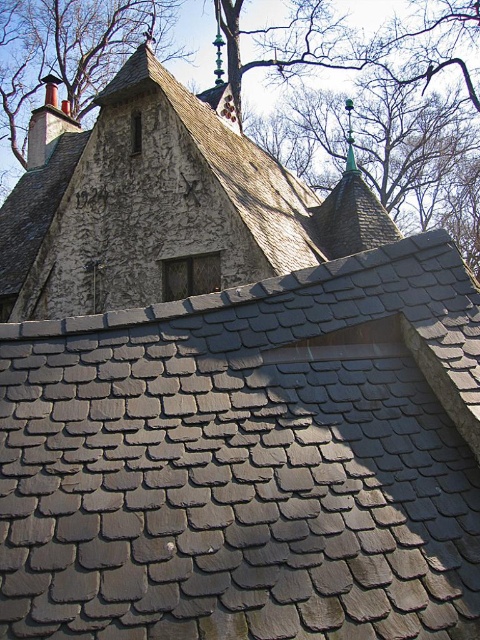
Question: Which of the following is the closest to the observer?

Choices:
 (A) green textured roof at upper center
 (B) green slate chimney at upper left
 (C) dark gray slate tile roof at upper center
 (D) gray slate roof at upper center

Answer: (C)

Question: Which object is positioned farthest from the gray slate roof at upper center?

Choices:
 (A) green textured roof at upper center
 (B) dark gray slate tile roof at upper center

Answer: (A)

Question: Which of these objects is positioned farthest from the dark gray slate tile roof at upper center?

Choices:
 (A) gray slate roof at upper center
 (B) green slate chimney at upper left
 (C) green textured roof at upper center

Answer: (C)

Question: Does gray slate roof at upper center appear on the left side of green textured roof at upper center?

Choices:
 (A) no
 (B) yes

Answer: (A)

Question: Does dark gray slate tile roof at upper center come in front of green slate chimney at upper left?

Choices:
 (A) no
 (B) yes

Answer: (B)

Question: Is gray slate roof at upper center to the right of green textured roof at upper center from the viewer's perspective?

Choices:
 (A) no
 (B) yes

Answer: (B)